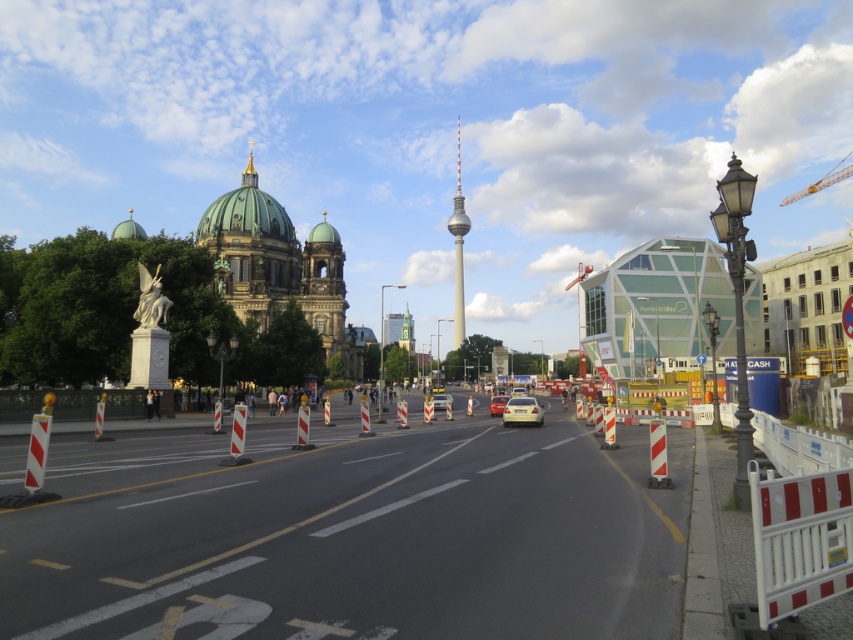
You are a tourist in Berlin, standing on the street in front of the Berlin Cathedral and the Fernsehturm. You see the white plastic barricades at center and the smooth gray tower at center. Which object is closer to you?

The white plastic barricades at center are closer to you because they are in front of the smooth gray tower at center.

You are a delivery driver who needs to navigate through the street in front of the Berlin Cathedral and Fernsehturm. Your truck is 18 meters long. Can you safely pass between the white plastic barricades at center and the matte silver sedan at center without hitting either?

The distance between the white plastic barricades at center and the matte silver sedan at center is 51.66 meters, which is greater than the truck length of 18 meters. Therefore, the truck can safely pass through the space between them.

You are a tourist in Berlin and want to take a photo of the Fernsehturm. You are standing at the point marked by the coordinates point (352, 536). Which direction should you turn to face the Fernsehturm?

The point (352, 536) corresponds to white plastic barricades at center. Since the Fernsehturm is located to the right of the Berlin Cathedral, which is on the left side of the image, you should turn to your right to face the Fernsehturm.